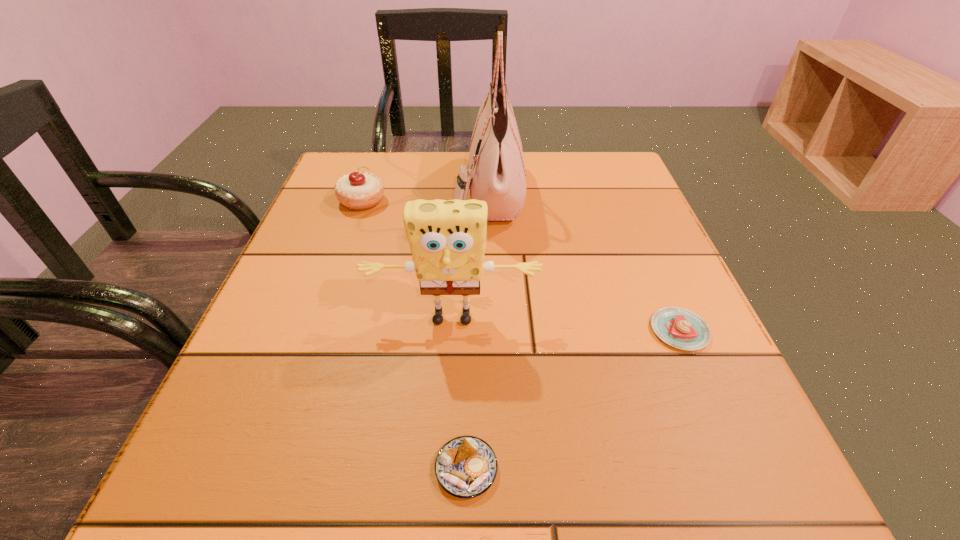
What are the coordinates of `vacant space located on the side of the tallest object with the attached pouch` in the screenshot? It's located at (420, 192).

At what (x,y) coordinates should I click in order to perform the action: click on free region located 0.080m on the face of the sponge. Please return your answer as a coordinate pair (x, y). Looking at the image, I should click on (448, 381).

Locate an element on the screen. The height and width of the screenshot is (540, 960). free space located 0.090m on the front of the leftmost object is located at coordinates (348, 239).

Where is `vacant space located on the left of the rightmost pastry`? The image size is (960, 540). vacant space located on the left of the rightmost pastry is located at coordinates [413, 330].

Where is `vacant space situated 0.100m on the right of the second pastry from left to right`? The width and height of the screenshot is (960, 540). vacant space situated 0.100m on the right of the second pastry from left to right is located at coordinates (575, 469).

Locate an element on the screen. handbag that is at the far edge is located at coordinates (497, 175).

Where is `pastry that is positioned at the far edge`? This screenshot has width=960, height=540. pastry that is positioned at the far edge is located at coordinates (363, 190).

The image size is (960, 540). Find the location of `object that is at the near edge`. object that is at the near edge is located at coordinates (466, 466).

Locate an element on the screen. This screenshot has height=540, width=960. object located in the left edge section of the desktop is located at coordinates (363, 190).

In order to click on object positioned at the right edge in this screenshot , I will do `click(680, 328)`.